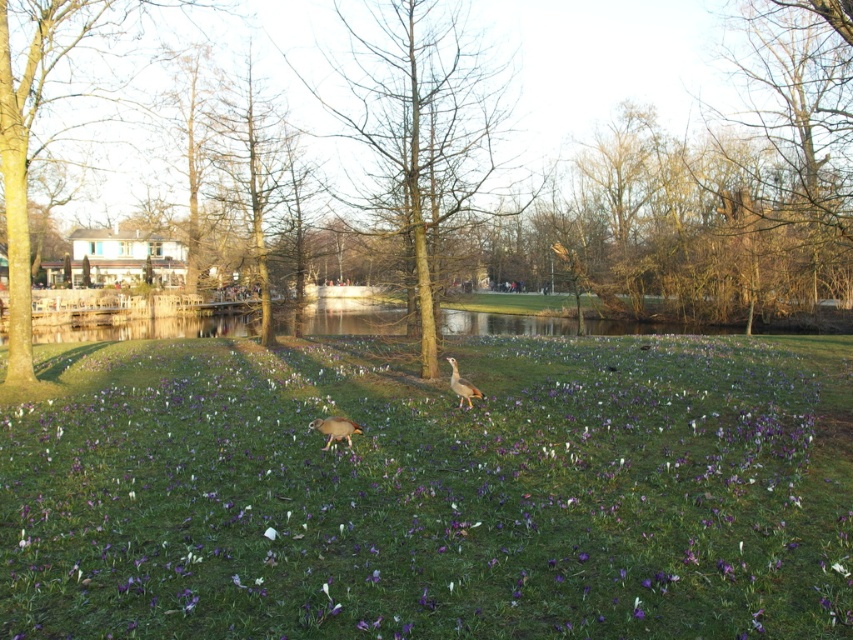
You are standing in the park and want to take a photo of the green matte tree at center and the green leafy tree at left. Which tree should you move towards if you want both trees to be in the same frame without moving the camera?

You should move towards the green leafy tree at left because the green matte tree at center is to the left of it, so moving towards the green leafy tree at left will bring both trees closer to the camera and into the same frame.